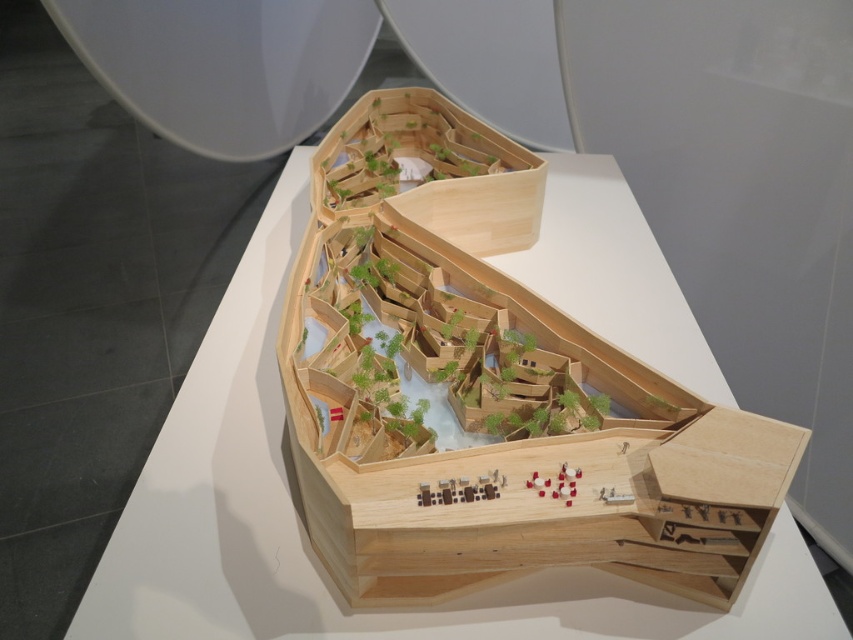
You are an architect examining the model from above. You notice two points marked on the model at coordinates point (694,534) and point (413,177). Which point is nearer to your viewpoint?

Point (694,534) is closer to the viewer than point (413,177), so the first point is nearer to your viewpoint.

You are standing in front of the architectural model and want to know how far the point at coordinates (x=350, y=232) is from your current position. Can you determine the distance?

The point at coordinates (x=350, y=232) is 21.65 feet away from the camera, so it is 21.65 feet away from your current position.